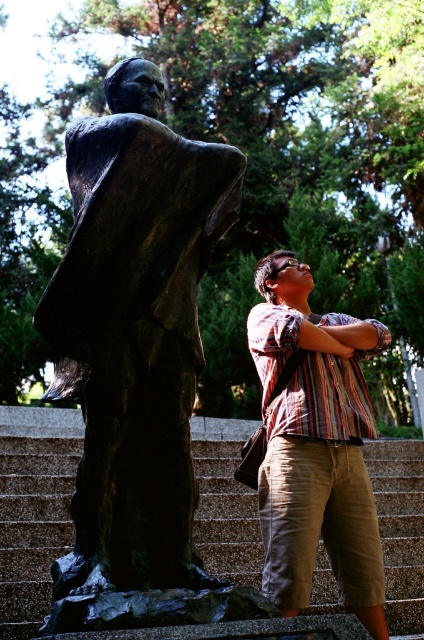
Is bronze statue at left bigger than striped cotton shirt at center?

Incorrect, bronze statue at left is not larger than striped cotton shirt at center.

Looking at this image, is bronze statue at left closer to camera compared to striped cotton shirt at center?

Yes, bronze statue at left is closer to the viewer.

Which is behind, point (178, 586) or point (329, 470)?

The point (329, 470) is more distant.

At what (x,y) coordinates should I click in order to perform the action: click on bronze statue at left. Please return your answer as a coordinate pair (x, y). Looking at the image, I should click on point(136,342).

Is striped cotton shirt at center above granite stairs at center?

Correct, striped cotton shirt at center is located above granite stairs at center.

This screenshot has height=640, width=424. What do you see at coordinates (315, 445) in the screenshot?
I see `striped cotton shirt at center` at bounding box center [315, 445].

Locate an element on the screen. striped cotton shirt at center is located at coordinates (315, 445).

Is bronze statue at left taller than granite stairs at center?

Yes, bronze statue at left is taller than granite stairs at center.

Is point (97, 116) farther from camera compared to point (387, 444)?

Yes, it is.

The height and width of the screenshot is (640, 424). Find the location of `bronze statue at left`. bronze statue at left is located at coordinates (136, 342).